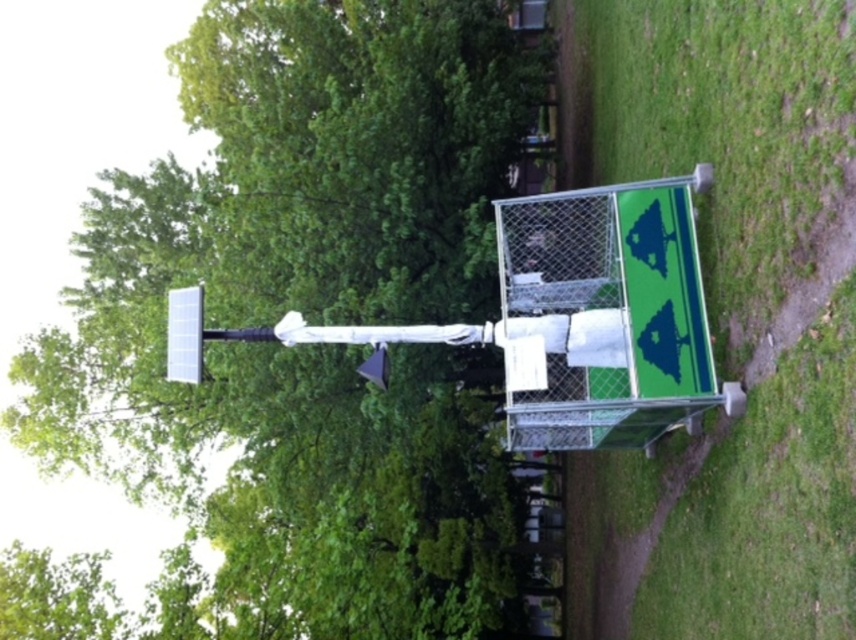
Question: Is green leafy tree at upper center above green grass at lower right?

Choices:
 (A) no
 (B) yes

Answer: (A)

Question: Can you confirm if green leafy tree at upper center is positioned to the right of green grass at lower right?

Choices:
 (A) yes
 (B) no

Answer: (B)

Question: Among these points, which one is nearest to the camera?

Choices:
 (A) click(x=146, y=234)
 (B) click(x=715, y=620)

Answer: (B)

Question: Does green leafy tree at upper center appear under green grass at lower right?

Choices:
 (A) yes
 (B) no

Answer: (A)